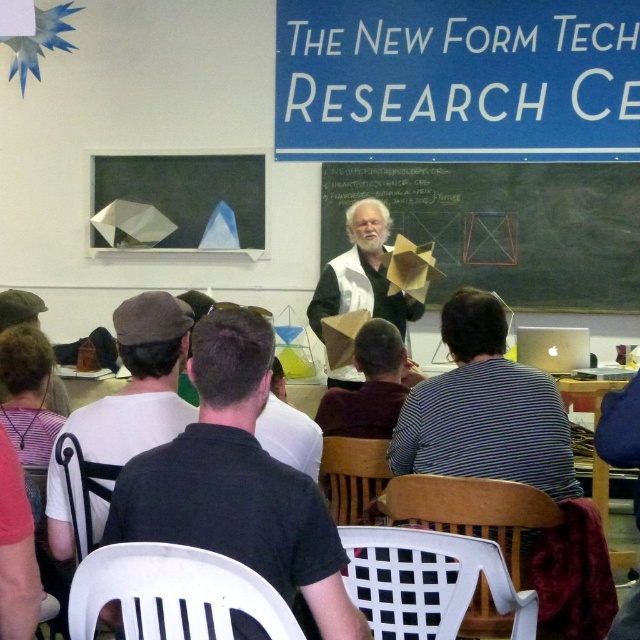
You are standing in the classroom and want to locate the dark gray fabric cap at lower left. Can you tell me its exact coordinates in the image?

The dark gray fabric cap at lower left is located at coordinates point (140, 381).

You are standing in the classroom and see two points marked on the floor. The first point is labeled as point [54,490] and the second is point [32,314]. Which point is closer to you?

Point [54,490] is closer to the viewer than point [32,314].

Consider the image. You are a student standing at the back of the classroom. You need to walk to the dark brown leather hat at lower left without passing in front of the matte black chalkboard at center. Is this possible given their positions?

The matte black chalkboard at center and dark brown leather hat at lower left are 3.22 meters apart. Since the chalkboard is at the center and the hat is at the lower left, you can walk around the side of the classroom to reach the hat without passing in front of the chalkboard.